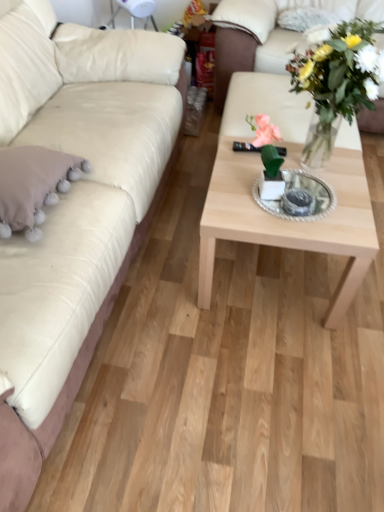
This screenshot has height=512, width=384. Identify the location of white leather studio couch at upper right, which ranks as the second studio couch in left-to-right order. (266, 33).

Describe the element at coordinates (290, 221) in the screenshot. I see `natural wood coffee table at center` at that location.

The height and width of the screenshot is (512, 384). In order to click on fluffy white pillow at upper right, marked as the first pillow in a right-to-left arrangement in this screenshot , I will do `click(305, 18)`.

The height and width of the screenshot is (512, 384). What do you see at coordinates (70, 207) in the screenshot?
I see `matte white couch at left, which ranks as the first studio couch in left-to-right order` at bounding box center [70, 207].

The image size is (384, 512). Identify the location of white leather studio couch at upper right, the first studio couch in the right-to-left sequence. (266, 33).

From the image's perspective, is matte white couch at left, which ranks as the first studio couch in left-to-right order, under beige fabric pillow at left, the second pillow positioned from the top?

Actually, matte white couch at left, which ranks as the first studio couch in left-to-right order, appears above beige fabric pillow at left, the second pillow positioned from the top, in the image.

Considering the positions of objects matte white couch at left, the 2th studio couch when ordered from right to left, and beige fabric pillow at left, the second pillow positioned from the top, in the image provided, who is behind, matte white couch at left, the 2th studio couch when ordered from right to left, or beige fabric pillow at left, the second pillow positioned from the top,?

beige fabric pillow at left, the second pillow positioned from the top, is further away from the camera.

Can you tell me how much matte white couch at left, which ranks as the first studio couch in left-to-right order, and beige fabric pillow at left, which is the 2th pillow from right to left, differ in facing direction?

The facing directions of matte white couch at left, which ranks as the first studio couch in left-to-right order, and beige fabric pillow at left, which is the 2th pillow from right to left, are 0.000213 degrees apart.

In terms of height, does beige fabric pillow at left, which appears as the 2th pillow when viewed from the back, look taller or shorter compared to fluffy white pillow at upper right, acting as the first pillow starting from the back?

beige fabric pillow at left, which appears as the 2th pillow when viewed from the back, is taller than fluffy white pillow at upper right, acting as the first pillow starting from the back.

Can you confirm if beige fabric pillow at left, the second pillow positioned from the top, is bigger than fluffy white pillow at upper right, which is counted as the 2th pillow, starting from the front?

Yes.

What's the angular difference between beige fabric pillow at left, which is the 2th pillow from right to left, and fluffy white pillow at upper right, marked as the first pillow in a right-to-left arrangement,'s facing directions?

They differ by 90.3 degrees in their facing directions.

Could you tell me if beige fabric pillow at left, the first pillow when ordered from bottom to top, is turned towards fluffy white pillow at upper right, acting as the first pillow starting from the back?

No, beige fabric pillow at left, the first pillow when ordered from bottom to top, is not turned towards fluffy white pillow at upper right, acting as the first pillow starting from the back.

From the picture: From a real-world perspective, is beige fabric pillow at left, marked as the first pillow in a front-to-back arrangement, positioned over matte white couch at left, the 2th studio couch when ordered from right to left, based on gravity?

Correct, in the physical world, beige fabric pillow at left, marked as the first pillow in a front-to-back arrangement, is higher than matte white couch at left, the 2th studio couch when ordered from right to left.

Would you say matte white couch at left, the 2th studio couch when ordered from right to left, is part of beige fabric pillow at left, marked as the first pillow in a front-to-back arrangement,'s contents?

No, beige fabric pillow at left, marked as the first pillow in a front-to-back arrangement, does not contain matte white couch at left, the 2th studio couch when ordered from right to left.

In the image, is beige fabric pillow at left, marked as the first pillow in a left-to-right arrangement, positioned in front of or behind matte white couch at left, which ranks as the first studio couch in left-to-right order?

beige fabric pillow at left, marked as the first pillow in a left-to-right arrangement, is positioned farther from the viewer than matte white couch at left, which ranks as the first studio couch in left-to-right order.

Is beige fabric pillow at left, the second pillow positioned from the top, turned away from matte white couch at left, the 2th studio couch when ordered from right to left?

Yes, beige fabric pillow at left, the second pillow positioned from the top,'s orientation is away from matte white couch at left, the 2th studio couch when ordered from right to left.

Is there a large distance between beige fabric pillow at left, the first pillow when ordered from bottom to top, and white leather studio couch at upper right, which ranks as the second studio couch in left-to-right order?

Yes, beige fabric pillow at left, the first pillow when ordered from bottom to top, and white leather studio couch at upper right, which ranks as the second studio couch in left-to-right order, are located far from each other.

Which is farther, (32, 197) or (232, 32)?

Point (232, 32)

Considering the relative positions of beige fabric pillow at left, marked as the first pillow in a front-to-back arrangement, and white leather studio couch at upper right, the first studio couch in the right-to-left sequence, in the image provided, is beige fabric pillow at left, marked as the first pillow in a front-to-back arrangement, to the left of white leather studio couch at upper right, the first studio couch in the right-to-left sequence, from the viewer's perspective?

Correct, you'll find beige fabric pillow at left, marked as the first pillow in a front-to-back arrangement, to the left of white leather studio couch at upper right, the first studio couch in the right-to-left sequence.

Which is more to the right, fluffy white pillow at upper right, the second pillow viewed from the left, or natural wood coffee table at center?

From the viewer's perspective, fluffy white pillow at upper right, the second pillow viewed from the left, appears more on the right side.

Consider the image. From a real-world perspective, is fluffy white pillow at upper right, acting as the first pillow starting from the back, located beneath natural wood coffee table at center?

No, from a real-world perspective, fluffy white pillow at upper right, acting as the first pillow starting from the back, is not below natural wood coffee table at center.

Is fluffy white pillow at upper right, the second pillow viewed from the left, placed right next to natural wood coffee table at center?

No, fluffy white pillow at upper right, the second pillow viewed from the left, is not touching natural wood coffee table at center.

Is fluffy white pillow at upper right, marked as the first pillow in a right-to-left arrangement, oriented away from natural wood coffee table at center?

That's not correct — fluffy white pillow at upper right, marked as the first pillow in a right-to-left arrangement, is not looking away from natural wood coffee table at center.

Is matte white couch at left, the 2th studio couch when ordered from right to left, far from fluffy white pillow at upper right, positioned as the 1th pillow in top-to-bottom order?

Yes, matte white couch at left, the 2th studio couch when ordered from right to left, and fluffy white pillow at upper right, positioned as the 1th pillow in top-to-bottom order, are quite far apart.

From the picture: Is matte white couch at left, the 2th studio couch when ordered from right to left, aimed at fluffy white pillow at upper right, the second pillow viewed from the left?

No, matte white couch at left, the 2th studio couch when ordered from right to left, is not oriented towards fluffy white pillow at upper right, the second pillow viewed from the left.

Locate an element on the screen. the 1st studio couch below the fluffy white pillow at upper right, marked as the first pillow in a right-to-left arrangement (from a real-world perspective) is located at coordinates (70, 207).

Considering the sizes of objects matte white couch at left, which ranks as the first studio couch in left-to-right order, and fluffy white pillow at upper right, acting as the first pillow starting from the back, in the image provided, who is thinner, matte white couch at left, which ranks as the first studio couch in left-to-right order, or fluffy white pillow at upper right, acting as the first pillow starting from the back,?

With smaller width is fluffy white pillow at upper right, acting as the first pillow starting from the back.

From a real-world perspective, is white leather studio couch at upper right, the first studio couch in the right-to-left sequence, physically above beige fabric pillow at left, marked as the first pillow in a front-to-back arrangement?

No, from a real-world perspective, white leather studio couch at upper right, the first studio couch in the right-to-left sequence, is not over beige fabric pillow at left, marked as the first pillow in a front-to-back arrangement

Looking at this image, can you confirm if white leather studio couch at upper right, the first studio couch in the right-to-left sequence, is smaller than beige fabric pillow at left, which appears as the 2th pillow when viewed from the back?

No.

How much distance is there between white leather studio couch at upper right, which ranks as the second studio couch in left-to-right order, and beige fabric pillow at left, marked as the first pillow in a left-to-right arrangement?

white leather studio couch at upper right, which ranks as the second studio couch in left-to-right order, and beige fabric pillow at left, marked as the first pillow in a left-to-right arrangement, are 3.89 feet apart from each other.

Between white leather studio couch at upper right, the first studio couch in the right-to-left sequence, and beige fabric pillow at left, marked as the first pillow in a left-to-right arrangement, which one has larger width?

With larger width is white leather studio couch at upper right, the first studio couch in the right-to-left sequence.

Find the location of a particular element. The height and width of the screenshot is (512, 384). the 1st pillow located above the matte white couch at left, which ranks as the first studio couch in left-to-right order (from a real-world perspective) is located at coordinates (33, 185).

Locate an element on the screen. Image resolution: width=384 pixels, height=512 pixels. pillow directly beneath the fluffy white pillow at upper right, acting as the first pillow starting from the back (from a real-world perspective) is located at coordinates (33, 185).

Based on their spatial positions, is natural wood coffee table at center or beige fabric pillow at left, the second pillow positioned from the top, further from fluffy white pillow at upper right, marked as the first pillow in a right-to-left arrangement?

Based on the image, beige fabric pillow at left, the second pillow positioned from the top, appears to be further to fluffy white pillow at upper right, marked as the first pillow in a right-to-left arrangement.

Considering their positions, is matte white couch at left, the 2th studio couch when ordered from right to left, positioned closer to fluffy white pillow at upper right, marked as the first pillow in a right-to-left arrangement, than beige fabric pillow at left, the first pillow when ordered from bottom to top?

Based on the image, matte white couch at left, the 2th studio couch when ordered from right to left, appears to be nearer to fluffy white pillow at upper right, marked as the first pillow in a right-to-left arrangement.

Estimate the real-world distances between objects in this image. Which object is closer to white leather studio couch at upper right, the first studio couch in the right-to-left sequence, fluffy white pillow at upper right, the 2th pillow when ordered from bottom to top, or beige fabric pillow at left, marked as the first pillow in a left-to-right arrangement?

fluffy white pillow at upper right, the 2th pillow when ordered from bottom to top.

Looking at the image, which one is located further to fluffy white pillow at upper right, positioned as the 1th pillow in top-to-bottom order, beige fabric pillow at left, which is the 2th pillow from right to left, or matte white couch at left, which ranks as the first studio couch in left-to-right order?

beige fabric pillow at left, which is the 2th pillow from right to left, is positioned further to the anchor fluffy white pillow at upper right, positioned as the 1th pillow in top-to-bottom order.

Based on their spatial positions, is fluffy white pillow at upper right, which is counted as the 2th pillow, starting from the front, or natural wood coffee table at center closer to beige fabric pillow at left, the first pillow when ordered from bottom to top?

natural wood coffee table at center is positioned closer to the anchor beige fabric pillow at left, the first pillow when ordered from bottom to top.

Which object lies further to the anchor point fluffy white pillow at upper right, acting as the first pillow starting from the back, white leather studio couch at upper right, which ranks as the second studio couch in left-to-right order, or natural wood coffee table at center?

Based on the image, natural wood coffee table at center appears to be further to fluffy white pillow at upper right, acting as the first pillow starting from the back.

Based on the photo, looking at the image, which one is located closer to fluffy white pillow at upper right, marked as the first pillow in a right-to-left arrangement, natural wood coffee table at center or matte white couch at left, which ranks as the first studio couch in left-to-right order?

natural wood coffee table at center is closer to fluffy white pillow at upper right, marked as the first pillow in a right-to-left arrangement.

Estimate the real-world distances between objects in this image. Which object is further from white leather studio couch at upper right, the first studio couch in the right-to-left sequence, natural wood coffee table at center or fluffy white pillow at upper right, acting as the first pillow starting from the back?

natural wood coffee table at center.

Where is `pillow located between matte white couch at left, which ranks as the first studio couch in left-to-right order, and white leather studio couch at upper right, which ranks as the second studio couch in left-to-right order, in the depth direction`? pillow located between matte white couch at left, which ranks as the first studio couch in left-to-right order, and white leather studio couch at upper right, which ranks as the second studio couch in left-to-right order, in the depth direction is located at coordinates (33, 185).

Identify the location of studio couch between matte white couch at left, the 2th studio couch when ordered from right to left, and fluffy white pillow at upper right, acting as the first pillow starting from the back, in the front-back direction. (266, 33).

This screenshot has height=512, width=384. I want to click on pillow located between beige fabric pillow at left, marked as the first pillow in a left-to-right arrangement, and white leather studio couch at upper right, which ranks as the second studio couch in left-to-right order, in the left-right direction, so click(305, 18).

You are a GUI agent. You are given a task and a screenshot of the screen. Output one action in this format:
    pyautogui.click(x=<x>, y=<y>)
    Task: Click on the pillow between fluffy white pillow at upper right, acting as the first pillow starting from the back, and natural wood coffee table at center, in the vertical direction
    
    Given the screenshot: What is the action you would take?
    pyautogui.click(x=33, y=185)